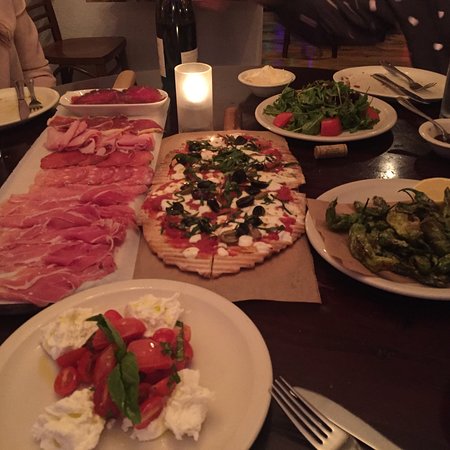
Locate an element on the screen. This screenshot has height=450, width=450. candle is located at coordinates (203, 117).